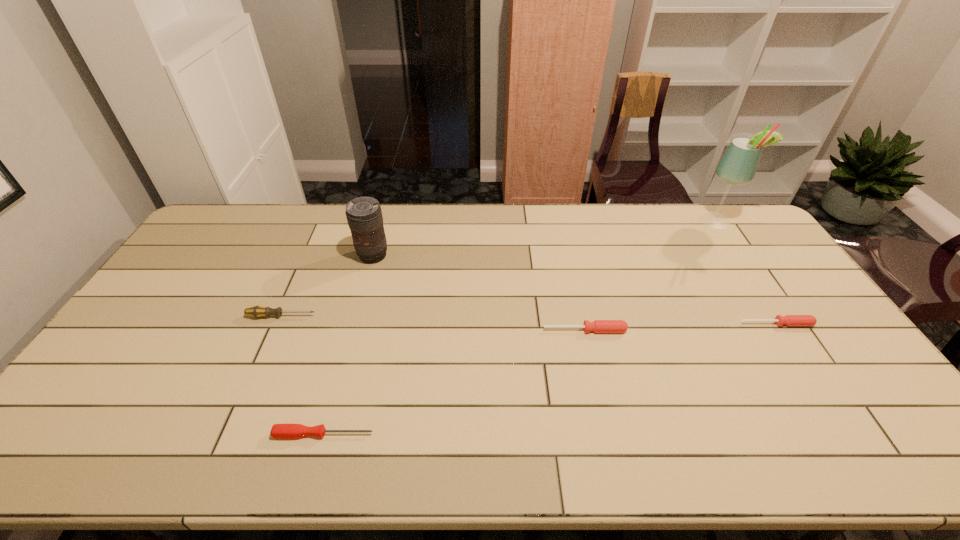
Image resolution: width=960 pixels, height=540 pixels. In order to click on free space between the nearest object and the tallest object in this screenshot , I will do `click(520, 328)`.

Identify the location of free spot between the alcohol and the rightmost screwdriver. Image resolution: width=960 pixels, height=540 pixels. (747, 272).

Identify which object is located as the fourth nearest to the farthest object. Please provide its 2D coordinates. Your answer should be formatted as a tuple, i.e. [(x, y)], where the tuple contains the x and y coordinates of a point satisfying the conditions above.

[(278, 431)]

Point out which object is positioned as the fifth nearest to the fifth shortest object. Please provide its 2D coordinates. Your answer should be formatted as a tuple, i.e. [(x, y)], where the tuple contains the x and y coordinates of a point satisfying the conditions above.

[(738, 165)]

Identify which screwdriver is located as the third nearest to the third object from right to left. Please provide its 2D coordinates. Your answer should be formatted as a tuple, i.e. [(x, y)], where the tuple contains the x and y coordinates of a point satisfying the conditions above.

[(257, 311)]

Identify the location of screwdriver object that ranks as the closest to the rightmost screwdriver. (598, 326).

Locate an element on the screen. The image size is (960, 540). vacant space that satisfies the following two spatial constraints: 1. on the side of the third object from right to left where the control switches are located; 2. on the right side of the telephoto lens is located at coordinates (352, 330).

The height and width of the screenshot is (540, 960). I want to click on vacant area that satisfies the following two spatial constraints: 1. at the tip of the leftmost object; 2. on the right side of the third object from right to left, so click(276, 330).

Where is `blank space that satisfies the following two spatial constraints: 1. on the side of the fifth shortest object where the control switches are located; 2. at the tip of the leftmost object`? The width and height of the screenshot is (960, 540). blank space that satisfies the following two spatial constraints: 1. on the side of the fifth shortest object where the control switches are located; 2. at the tip of the leftmost object is located at coordinates (356, 316).

Find the location of `free spot that satisfies the following two spatial constraints: 1. on the side of the second tallest object where the control switches are located; 2. at the tip of the nearest object`. free spot that satisfies the following two spatial constraints: 1. on the side of the second tallest object where the control switches are located; 2. at the tip of the nearest object is located at coordinates (324, 434).